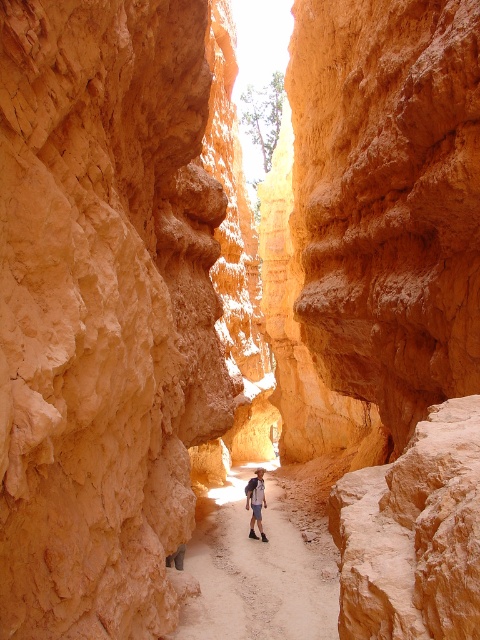
Question: Observing the image, what is the correct spatial positioning of sandy dirt path at center in reference to denim shorts at center?

Choices:
 (A) below
 (B) above

Answer: (A)

Question: Does sandy dirt path at center appear on the right side of denim shorts at center?

Choices:
 (A) yes
 (B) no

Answer: (A)

Question: Is sandy dirt path at center behind denim shorts at center?

Choices:
 (A) yes
 (B) no

Answer: (B)

Question: Which of the following is the farthest from the observer?

Choices:
 (A) (271, 580)
 (B) (256, 500)

Answer: (B)

Question: Which object is closer to the camera taking this photo?

Choices:
 (A) denim shorts at center
 (B) sandy dirt path at center

Answer: (B)